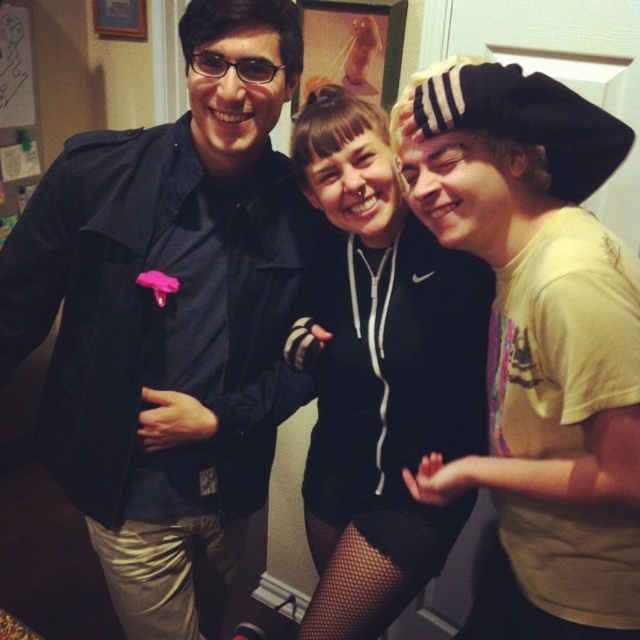
Question: Can you confirm if matte black jacket at center is thinner than yellow matte t-shirt at right?

Choices:
 (A) yes
 (B) no

Answer: (B)

Question: Which point appears farthest from the camera in this image?

Choices:
 (A) (588, 259)
 (B) (362, 596)
 (C) (280, 168)

Answer: (B)

Question: Among these points, which one is farthest from the camera?

Choices:
 (A) pos(77,358)
 (B) pos(504,188)
 (C) pos(308,486)

Answer: (C)

Question: Which is nearer to the yellow matte t-shirt at right?

Choices:
 (A) black hoodie at center
 (B) matte black jacket at center

Answer: (A)

Question: Does matte black jacket at center appear over yellow matte t-shirt at right?

Choices:
 (A) yes
 (B) no

Answer: (B)

Question: Is matte black jacket at center closer to the viewer compared to yellow matte t-shirt at right?

Choices:
 (A) no
 (B) yes

Answer: (A)